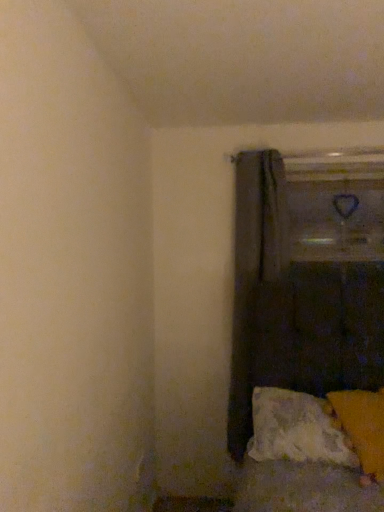
Question: From a real-world perspective, is textured white pillow at lower right, the first pillow positioned from the left, located beneath orange fabric pillow at lower right, acting as the 2th pillow starting from the left?

Choices:
 (A) yes
 (B) no

Answer: (A)

Question: Does textured white pillow at lower right, the first pillow positioned from the left, have a lesser width compared to orange fabric pillow at lower right, acting as the 2th pillow starting from the left?

Choices:
 (A) yes
 (B) no

Answer: (A)

Question: Is textured white pillow at lower right, which ranks as the second pillow in right-to-left order, behind orange fabric pillow at lower right, acting as the 2th pillow starting from the left?

Choices:
 (A) yes
 (B) no

Answer: (A)

Question: Does textured white pillow at lower right, the first pillow positioned from the left, touch orange fabric pillow at lower right, which appears as the first pillow when viewed from the right?

Choices:
 (A) yes
 (B) no

Answer: (B)

Question: From the image's perspective, would you say textured white pillow at lower right, the first pillow positioned from the left, is shown under orange fabric pillow at lower right, acting as the 2th pillow starting from the left?

Choices:
 (A) yes
 (B) no

Answer: (A)

Question: Is textured white pillow at lower right, which ranks as the second pillow in right-to-left order, located outside orange fabric pillow at lower right, which appears as the first pillow when viewed from the right?

Choices:
 (A) no
 (B) yes

Answer: (A)

Question: From the image's perspective, would you say textured white pillow at lower right, which ranks as the second pillow in right-to-left order, is shown under dark gray fabric curtain at center?

Choices:
 (A) no
 (B) yes

Answer: (B)

Question: Is textured white pillow at lower right, the first pillow positioned from the left, far from dark gray fabric curtain at center?

Choices:
 (A) no
 (B) yes

Answer: (A)

Question: From a real-world perspective, is textured white pillow at lower right, the first pillow positioned from the left, located beneath dark gray fabric curtain at center?

Choices:
 (A) no
 (B) yes

Answer: (B)

Question: Is the position of textured white pillow at lower right, the first pillow positioned from the left, more distant than that of dark gray fabric curtain at center?

Choices:
 (A) yes
 (B) no

Answer: (B)

Question: Is textured white pillow at lower right, the first pillow positioned from the left, wider than dark gray fabric curtain at center?

Choices:
 (A) no
 (B) yes

Answer: (B)

Question: Is textured white pillow at lower right, the first pillow positioned from the left, not inside dark gray fabric curtain at center?

Choices:
 (A) yes
 (B) no

Answer: (A)

Question: Are dark gray fabric curtain at center and textured white pillow at lower right, which ranks as the second pillow in right-to-left order, far apart?

Choices:
 (A) no
 (B) yes

Answer: (A)